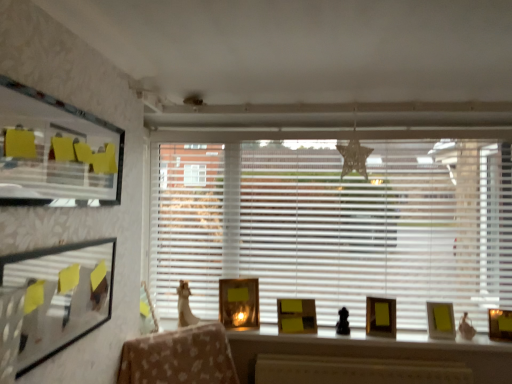
Where is `blank space to the left of matte gold picture frame at right, placed as the third picture frame when sorted from back to front`? The height and width of the screenshot is (384, 512). blank space to the left of matte gold picture frame at right, placed as the third picture frame when sorted from back to front is located at coordinates tap(419, 337).